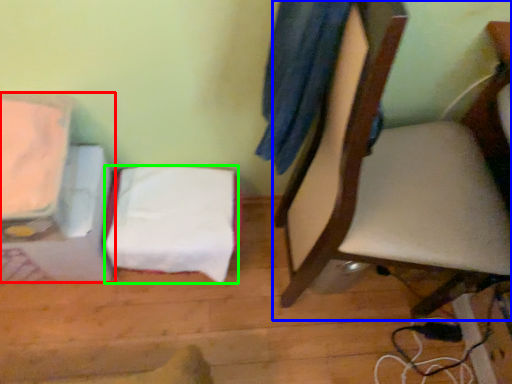
Question: Which object is the farthest from furniture (highlighted by a red box)? Choose among these: chair (highlighted by a blue box) or sheet (highlighted by a green box).

Choices:
 (A) chair
 (B) sheet

Answer: (A)